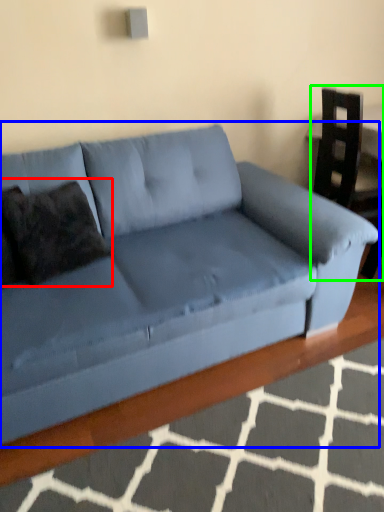
Question: Based on their relative distances, which object is farther from pillow (highlighted by a red box)? Choose from studio couch (highlighted by a blue box) and armchair (highlighted by a green box).

Choices:
 (A) studio couch
 (B) armchair

Answer: (B)